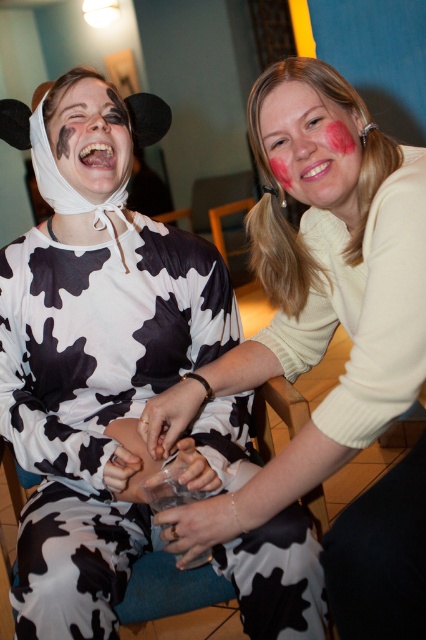
Can you confirm if matte white sweater at center is positioned below black matte paint at upper left?

Yes.

Does point (367, 515) lie behind point (112, 186)?

No, it is not.

Locate an element on the screen. matte white sweater at center is located at coordinates (313, 292).

Is the position of matte white sweater at center less distant than that of pink matte face paint at upper center?

Yes, matte white sweater at center is in front of pink matte face paint at upper center.

Locate an element on the screen. Image resolution: width=426 pixels, height=640 pixels. matte white sweater at center is located at coordinates (313, 292).

Who is lower down, matte black cow print dress at center or black matte paint at upper left?

Positioned lower is matte black cow print dress at center.

Does matte black cow print dress at center have a smaller size compared to black matte paint at upper left?

No, matte black cow print dress at center is not smaller than black matte paint at upper left.

Which is behind, point (123, 324) or point (89, 164)?

The point (123, 324) is behind.

This screenshot has width=426, height=640. I want to click on matte black cow print dress at center, so click(94, 349).